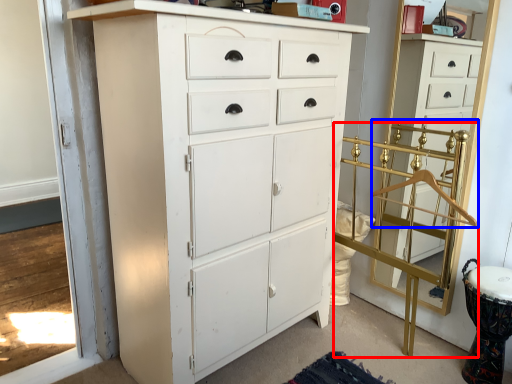
Question: Which object is further to the camera taking this photo, bunk bed (highlighted by a red box) or hanger (highlighted by a blue box)?

Choices:
 (A) bunk bed
 (B) hanger

Answer: (B)